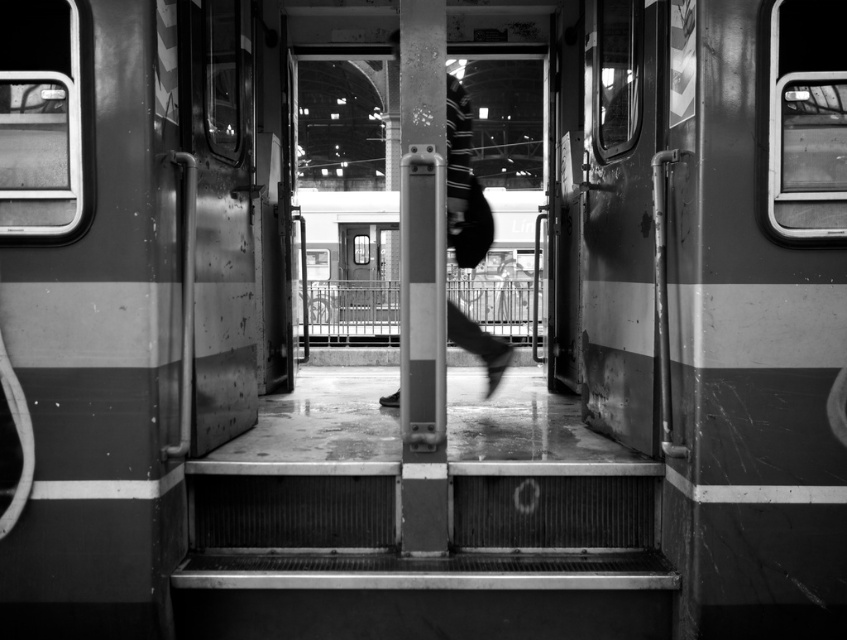
Between metallic silver railing at center and black fabric bag at center, which one appears on the right side from the viewer's perspective?

black fabric bag at center

Between metallic silver railing at center and black fabric bag at center, which one is positioned lower?

metallic silver railing at center

Between point (479, 321) and point (472, 195), which one is positioned in front?

Point (472, 195) is in front.

The image size is (847, 640). Find the location of `metallic silver railing at center`. metallic silver railing at center is located at coordinates (352, 310).